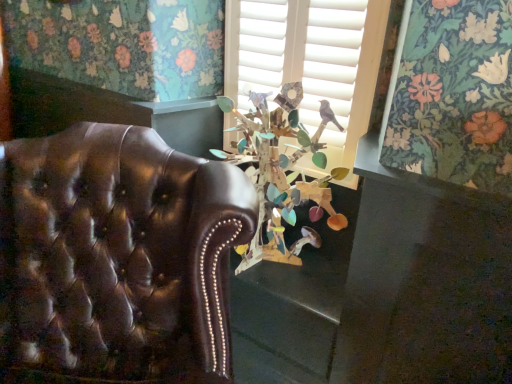
Question: Should I look upward or downward to see wooden birdhouse at center?

Choices:
 (A) up
 (B) down

Answer: (A)

Question: Is wooden birdhouse at center closer to camera compared to wooden birdhouse at center?

Choices:
 (A) yes
 (B) no

Answer: (B)

Question: Is wooden birdhouse at center bigger than wooden birdhouse at center?

Choices:
 (A) yes
 (B) no

Answer: (B)

Question: Is wooden birdhouse at center outside wooden birdhouse at center?

Choices:
 (A) yes
 (B) no

Answer: (A)

Question: Is wooden birdhouse at center inside wooden birdhouse at center?

Choices:
 (A) no
 (B) yes

Answer: (A)

Question: Can you confirm if wooden birdhouse at center is taller than wooden birdhouse at center?

Choices:
 (A) yes
 (B) no

Answer: (A)

Question: From the image's perspective, is wooden birdhouse at center located beneath wooden birdhouse at center?

Choices:
 (A) yes
 (B) no

Answer: (B)

Question: Can you confirm if wooden birdhouse at center is taller than wooden birdhouse at center?

Choices:
 (A) no
 (B) yes

Answer: (A)

Question: Is wooden birdhouse at center positioned with its back to wooden birdhouse at center?

Choices:
 (A) no
 (B) yes

Answer: (B)

Question: Is wooden birdhouse at center to the right of wooden birdhouse at center from the viewer's perspective?

Choices:
 (A) yes
 (B) no

Answer: (B)

Question: Is wooden birdhouse at center aimed at wooden birdhouse at center?

Choices:
 (A) no
 (B) yes

Answer: (B)

Question: From the image's perspective, does wooden birdhouse at center appear lower than wooden birdhouse at center?

Choices:
 (A) yes
 (B) no

Answer: (A)

Question: Is wooden birdhouse at center positioned far away from wooden birdhouse at center?

Choices:
 (A) no
 (B) yes

Answer: (A)

Question: From the image's perspective, does wooden birdhouse at center appear lower than shiny brown leather chair at left?

Choices:
 (A) yes
 (B) no

Answer: (B)